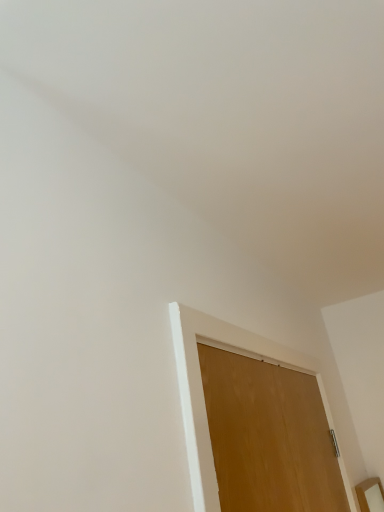
Locate an element on the screen. wooden door at center is located at coordinates (268, 437).

Measure the distance between point [217,426] and camera.

They are 99.40 centimeters apart.

Measure the distance between wooden door at center and camera.

wooden door at center is 35.64 inches away from camera.

The image size is (384, 512). Describe the element at coordinates (268, 437) in the screenshot. I see `wooden door at center` at that location.

This screenshot has height=512, width=384. I want to click on wooden door at center, so click(268, 437).